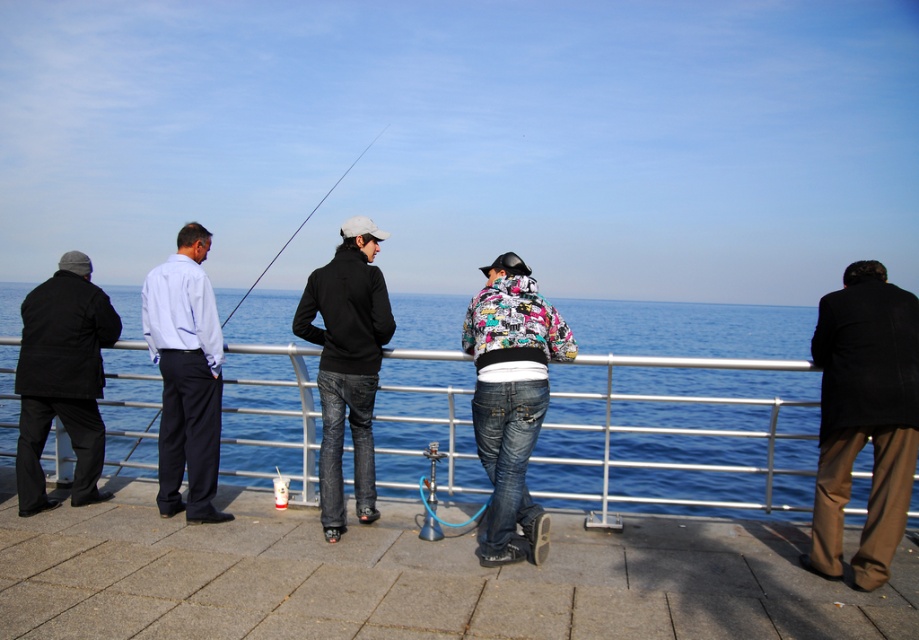
Question: Can you confirm if brown woolen coat at right is thinner than matte black jacket at left?

Choices:
 (A) yes
 (B) no

Answer: (A)

Question: Is printed fabric hoodie at center positioned behind black matte jacket at center?

Choices:
 (A) yes
 (B) no

Answer: (B)

Question: Is brown woolen coat at right bigger than printed fabric hoodie at center?

Choices:
 (A) yes
 (B) no

Answer: (A)

Question: Which point is closer to the camera?

Choices:
 (A) (637, 566)
 (B) (888, 420)
 (C) (698, 387)
 (D) (478, 440)

Answer: (B)

Question: Which point appears farthest from the camera in this image?

Choices:
 (A) (352, 163)
 (B) (534, 308)
 (C) (87, 512)

Answer: (A)

Question: Which point is closer to the camera taking this photo?

Choices:
 (A) (339, 276)
 (B) (494, 481)
 (C) (86, 464)
 (D) (861, 323)

Answer: (D)